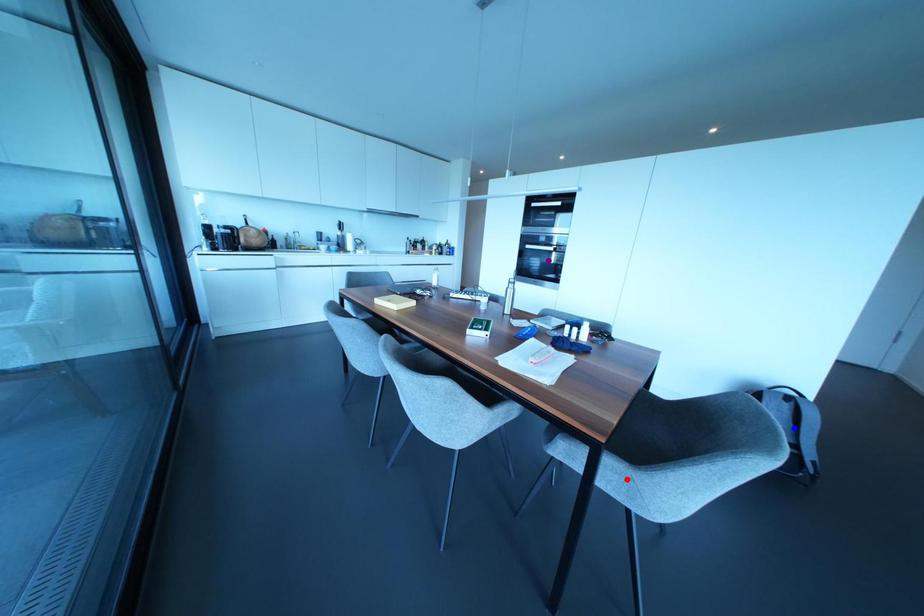
Consider the image. Order these from nearest to farthest:
red point | blue point | purple point

1. red point
2. blue point
3. purple point